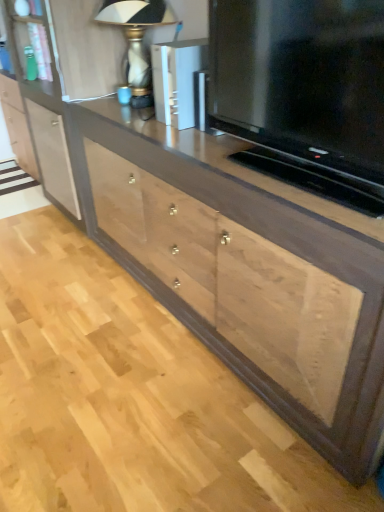
Where is `vacant space underneath matte black television at center (from a real-world perspective)`? The image size is (384, 512). vacant space underneath matte black television at center (from a real-world perspective) is located at coordinates (294, 169).